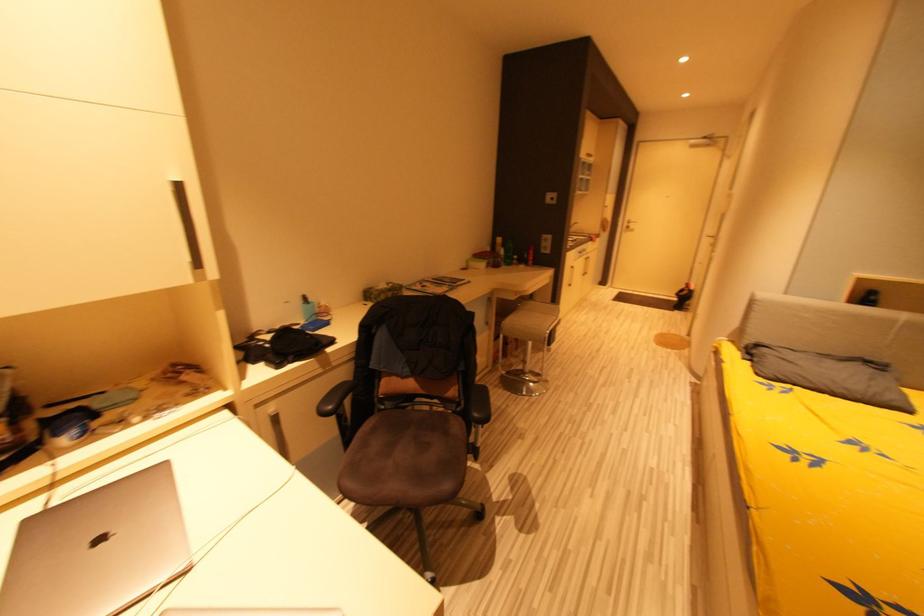
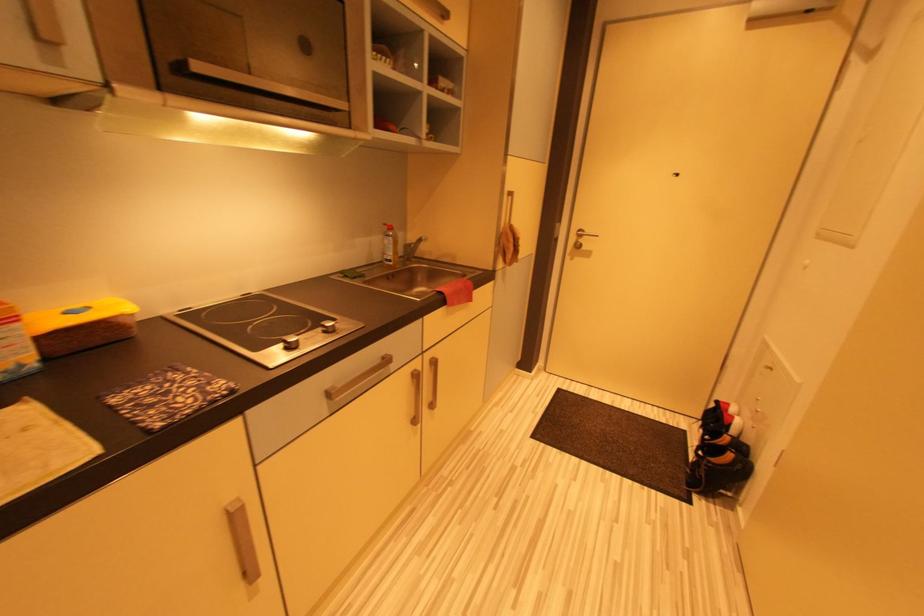
Which direction would the cameraman need to move to produce the second image?

The movement direction of the cameraman is right, forward.